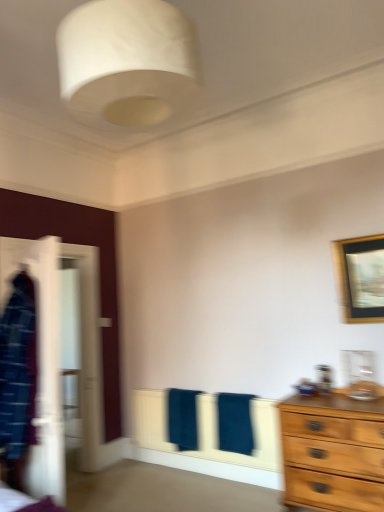
Question: Is dark blue towel at center, marked as the second bath towel in a right-to-left arrangement, situated inside dark blue towel at center, which appears as the 1th bath towel when viewed from the right, or outside?

Choices:
 (A) inside
 (B) outside

Answer: (B)

Question: Considering the positions of dark blue towel at center, positioned as the 1th bath towel in left-to-right order, and dark blue towel at center, which appears as the 1th bath towel when viewed from the right, in the image, is dark blue towel at center, positioned as the 1th bath towel in left-to-right order, taller or shorter than dark blue towel at center, which appears as the 1th bath towel when viewed from the right,?

Choices:
 (A) tall
 (B) short

Answer: (B)

Question: Estimate the real-world distances between objects in this image. Which object is farther from the wooden framed picture at upper right?

Choices:
 (A) dark blue towel at center, which appears as the 1th bath towel when viewed from the right
 (B) dark blue towel at center, positioned as the 1th bath towel in left-to-right order
 (C) white glossy wardrobe at left
 (D) white fabric lampshade at upper center

Answer: (C)

Question: Considering the real-world distances, which object is farthest from the dark blue towel at center, positioned as the 1th bath towel in left-to-right order?

Choices:
 (A) white glossy wardrobe at left
 (B) white fabric lampshade at upper center
 (C) dark blue towel at center, the 2th bath towel in the left-to-right sequence
 (D) wooden framed picture at upper right

Answer: (B)